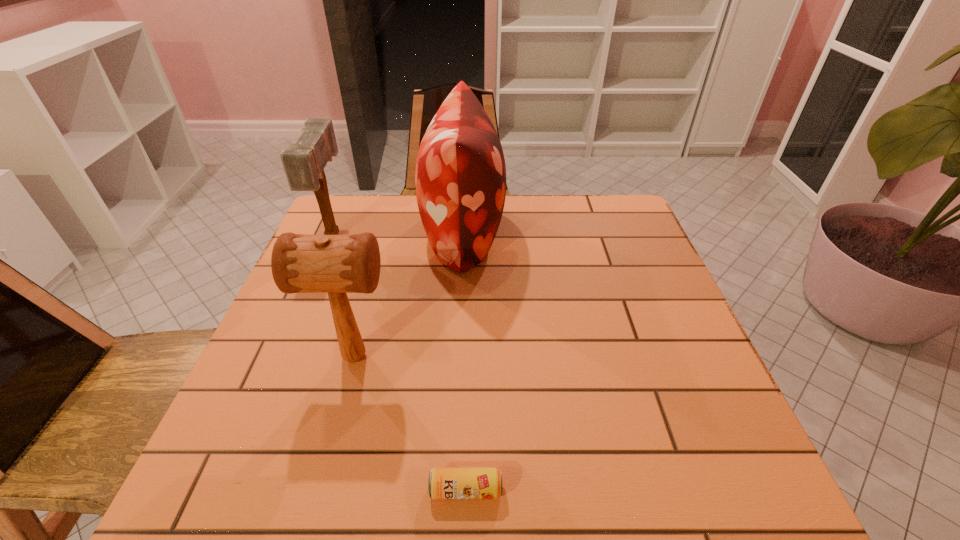
You are a GUI agent. You are given a task and a screenshot of the screen. Output one action in this format:
    pyautogui.click(x=<x>, y=<y>)
    Task: Click on the cushion
    This screenshot has width=960, height=540.
    Given the screenshot: What is the action you would take?
    pyautogui.click(x=460, y=177)

The width and height of the screenshot is (960, 540). Find the location of `the nearer mallet`. the nearer mallet is located at coordinates (301, 263).

This screenshot has width=960, height=540. I want to click on the right mallet, so click(301, 263).

Locate an element on the screen. This screenshot has width=960, height=540. the left mallet is located at coordinates (304, 163).

This screenshot has height=540, width=960. Find the location of `the leftmost object`. the leftmost object is located at coordinates (304, 163).

The height and width of the screenshot is (540, 960). What are the coordinates of `beer can` in the screenshot? It's located at (444, 483).

This screenshot has width=960, height=540. In order to click on the nearest object in this screenshot , I will do `click(444, 483)`.

Locate an element on the screen. This screenshot has width=960, height=540. vacant space located on the front-facing side of the cushion is located at coordinates (604, 232).

Find the location of a particular element. This screenshot has width=960, height=540. vacant space located 0.270m on the strike surface of the second nearest object is located at coordinates (528, 357).

Find the location of `free space located on the front of the left mallet`. free space located on the front of the left mallet is located at coordinates [x=283, y=354].